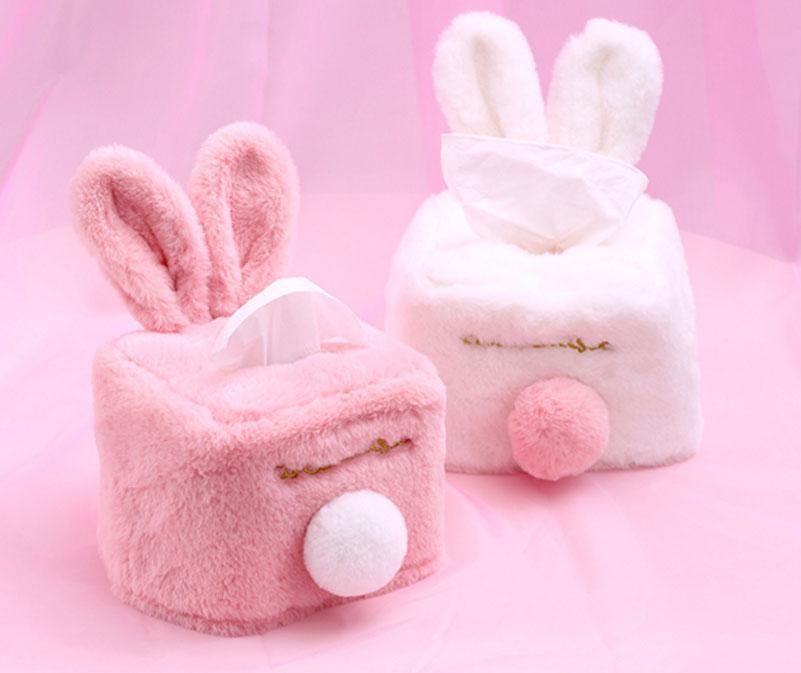
Image resolution: width=801 pixels, height=673 pixels. Identify the location of white keenex box cover. (479, 297).